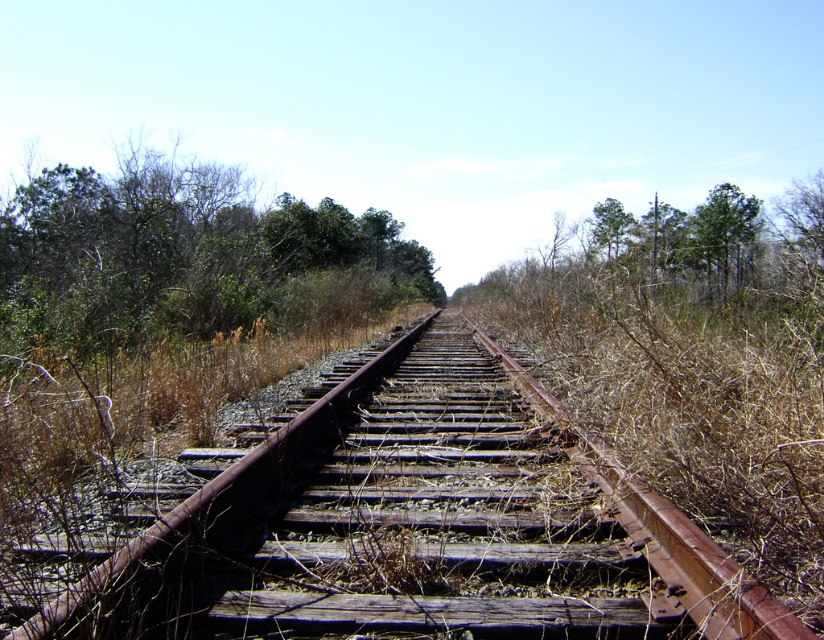
Does rusty metal train track at center appear on the right side of green leafy trees at upper center?

Indeed, rusty metal train track at center is positioned on the right side of green leafy trees at upper center.

Measure the distance between point (384, 468) and camera.

Result: Point (384, 468) is 13.93 feet away from camera.

Measure the distance between point (527, 394) and camera.

A distance of 6.70 meters exists between point (527, 394) and camera.

Locate an element on the screen. The image size is (824, 640). rusty metal train track at center is located at coordinates (419, 524).

Which is more to the left, rusty metal train track at center or green leafy tree at upper right?

Positioned to the left is rusty metal train track at center.

Can you confirm if rusty metal train track at center is wider than green leafy tree at upper right?

No.

Which is behind, point (649, 630) or point (722, 218)?

The point (722, 218) is behind.

Image resolution: width=824 pixels, height=640 pixels. I want to click on rusty metal train track at center, so click(419, 524).

Does green leafy trees at upper center appear on the left side of green leafy tree at upper right?

Yes, green leafy trees at upper center is to the left of green leafy tree at upper right.

Between point (284, 250) and point (701, 257), which one is positioned in front?

Point (284, 250) is in front.

Does point (282, 241) come farther from viewer compared to point (738, 230)?

No, (282, 241) is in front of (738, 230).

Where is `green leafy trees at upper center`? This screenshot has width=824, height=640. green leafy trees at upper center is located at coordinates (185, 256).